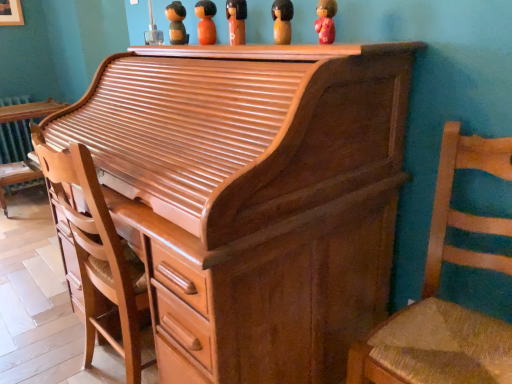
Question: Is shiny brown wood desk at left positioned far away from matte orange doll at upper center, acting as the third toy starting from the back?

Choices:
 (A) yes
 (B) no

Answer: (A)

Question: Does shiny brown wood desk at left touch matte orange doll at upper center, acting as the third toy starting from the back?

Choices:
 (A) no
 (B) yes

Answer: (A)

Question: Considering the relative sizes of shiny brown wood desk at left and matte orange doll at upper center, acting as the third toy starting from the back, in the image provided, is shiny brown wood desk at left taller than matte orange doll at upper center, acting as the third toy starting from the back,?

Choices:
 (A) no
 (B) yes

Answer: (B)

Question: Is shiny brown wood desk at left aimed at matte orange doll at upper center, which is the third toy from left to right?

Choices:
 (A) no
 (B) yes

Answer: (B)

Question: Is shiny brown wood desk at left to the right of matte orange doll at upper center, acting as the third toy starting from the back, from the viewer's perspective?

Choices:
 (A) no
 (B) yes

Answer: (A)

Question: Looking at the image, does light brown wood chair at left, marked as the 2th chair in a right-to-left arrangement, seem bigger or smaller compared to matte orange doll at upper center, acting as the third toy starting from the back?

Choices:
 (A) big
 (B) small

Answer: (A)

Question: In the image, is light brown wood chair at left, marked as the 2th chair in a right-to-left arrangement, on the left side or the right side of matte orange doll at upper center, acting as the third toy starting from the back?

Choices:
 (A) right
 (B) left

Answer: (B)

Question: Is point [x=39, y=137] closer or farther from the camera than point [x=242, y=8]?

Choices:
 (A) farther
 (B) closer

Answer: (B)

Question: From a real-world perspective, is light brown wood chair at left, the first chair in the left-to-right sequence, positioned above or below matte orange doll at upper center, which ranks as the 3th toy in right-to-left order?

Choices:
 (A) below
 (B) above

Answer: (A)

Question: In the image, is wooden woven seat at right, which is counted as the 1th chair, starting from the right, on the left side or the right side of shiny brown piano at center?

Choices:
 (A) left
 (B) right

Answer: (B)

Question: Do you think wooden woven seat at right, which is counted as the 1th chair, starting from the right, is within shiny brown piano at center, or outside of it?

Choices:
 (A) inside
 (B) outside

Answer: (B)

Question: From a real-world perspective, relative to shiny brown piano at center, is wooden woven seat at right, which is counted as the 1th chair, starting from the right, vertically above or below?

Choices:
 (A) below
 (B) above

Answer: (A)

Question: Considering the positions of wooden woven seat at right, positioned as the 2th chair in left-to-right order, and shiny brown piano at center in the image, is wooden woven seat at right, positioned as the 2th chair in left-to-right order, wider or thinner than shiny brown piano at center?

Choices:
 (A) thin
 (B) wide

Answer: (A)

Question: Do you think wooden figurine at upper center, positioned as the fifth toy in right-to-left order, is within wooden woven seat at right, which is counted as the 1th chair, starting from the right, or outside of it?

Choices:
 (A) inside
 (B) outside

Answer: (B)

Question: Considering the positions of point [x=177, y=29] and point [x=475, y=264], is point [x=177, y=29] closer or farther from the camera than point [x=475, y=264]?

Choices:
 (A) farther
 (B) closer

Answer: (A)